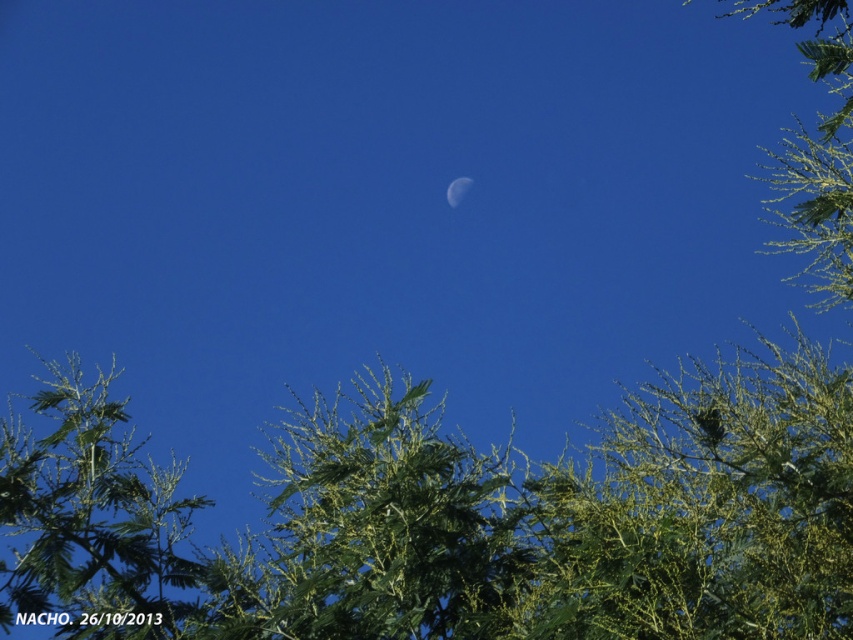
You are an astronomer observing the night sky. You notice the green leafy tree at lower left and the white glossy moon at center. Which object is positioned to the left of the other?

The green leafy tree at lower left is positioned to the left of the white glossy moon at center.

You are standing in a garden at night, and you want to take a photo of the green leafy tree at center. If your camera has a maximum focus distance of 10 meters, will it be able to capture the tree clearly?

The green leafy tree at center and camera are 8.74 meters apart from each other, so yes, the camera can focus on the tree since the distance is within its maximum focus range of 10 meters.